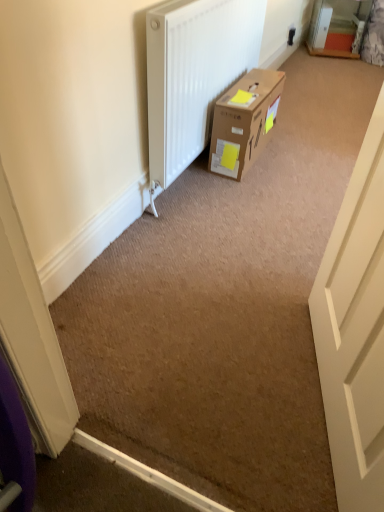
Question: Is brown cardboard box at center oriented towards white matte door at right?

Choices:
 (A) yes
 (B) no

Answer: (B)

Question: From a real-world perspective, is brown cardboard box at center on top of white matte door at right?

Choices:
 (A) no
 (B) yes

Answer: (A)

Question: Considering the relative sizes of brown cardboard box at center and white matte door at right in the image provided, is brown cardboard box at center bigger than white matte door at right?

Choices:
 (A) no
 (B) yes

Answer: (A)

Question: Does brown cardboard box at center appear on the right side of white matte door at right?

Choices:
 (A) yes
 (B) no

Answer: (B)

Question: Is brown cardboard box at center positioned beyond the bounds of white matte door at right?

Choices:
 (A) no
 (B) yes

Answer: (B)

Question: From their relative heights in the image, would you say brown cardboard box at center is taller or shorter than white plastic electric outlet at upper right?

Choices:
 (A) short
 (B) tall

Answer: (B)

Question: From a real-world perspective, is brown cardboard box at center above or below white plastic electric outlet at upper right?

Choices:
 (A) below
 (B) above

Answer: (B)

Question: Considering the positions of point (220, 112) and point (291, 41), is point (220, 112) closer or farther from the camera than point (291, 41)?

Choices:
 (A) closer
 (B) farther

Answer: (A)

Question: Based on their sizes in the image, would you say brown cardboard box at center is bigger or smaller than white plastic electric outlet at upper right?

Choices:
 (A) small
 (B) big

Answer: (B)

Question: Is point (344, 229) closer or farther from the camera than point (218, 111)?

Choices:
 (A) farther
 (B) closer

Answer: (B)

Question: In terms of width, does white matte door at right look wider or thinner when compared to brown cardboard box at center?

Choices:
 (A) wide
 (B) thin

Answer: (B)

Question: Is white matte door at right to the left or to the right of brown cardboard box at center in the image?

Choices:
 (A) right
 (B) left

Answer: (A)

Question: From a real-world perspective, relative to brown cardboard box at center, is white matte door at right vertically above or below?

Choices:
 (A) above
 (B) below

Answer: (A)

Question: Is point (322, 384) closer or farther from the camera than point (286, 41)?

Choices:
 (A) farther
 (B) closer

Answer: (B)

Question: In the image, is white matte door at right positioned in front of or behind white plastic electric outlet at upper right?

Choices:
 (A) front
 (B) behind

Answer: (A)